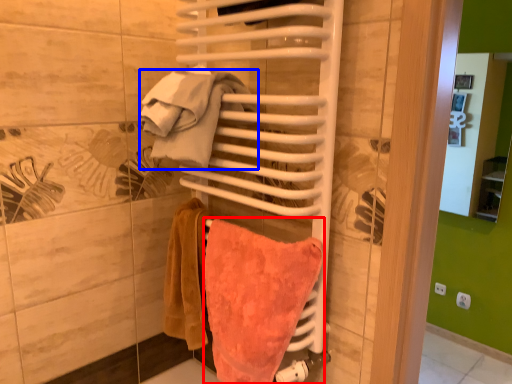
Question: Which object appears farthest to the camera in this image, towel (highlighted by a red box) or beach towel (highlighted by a blue box)?

Choices:
 (A) towel
 (B) beach towel

Answer: (B)